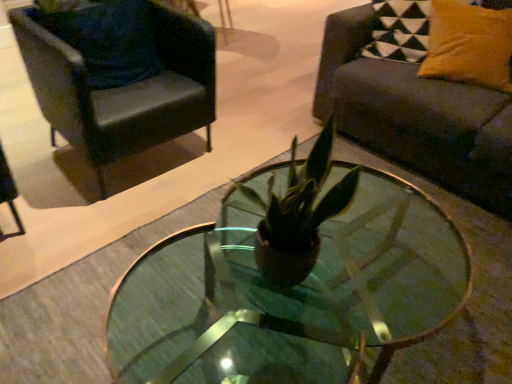
Question: Do you think black leather chair at upper left is within transparent glass coffee table at center, or outside of it?

Choices:
 (A) outside
 (B) inside

Answer: (A)

Question: In the image, is black leather chair at upper left positioned in front of or behind transparent glass coffee table at center?

Choices:
 (A) behind
 (B) front

Answer: (A)

Question: Which object is the farthest from the black leather chair at upper left?

Choices:
 (A) velvet yellow pillow at upper right, which is the 2th pillow from left to right
 (B) transparent glass coffee table at center
 (C) velvet dark blue pillow at upper left, positioned as the 1th pillow in left-to-right order
 (D) dark gray fabric couch at right

Answer: (A)

Question: Considering the real-world distances, which object is farthest from the transparent glass coffee table at center?

Choices:
 (A) velvet yellow pillow at upper right, which is the 2th pillow from left to right
 (B) dark gray fabric couch at right
 (C) velvet dark blue pillow at upper left, marked as the 2th pillow in a right-to-left arrangement
 (D) black leather chair at upper left

Answer: (C)